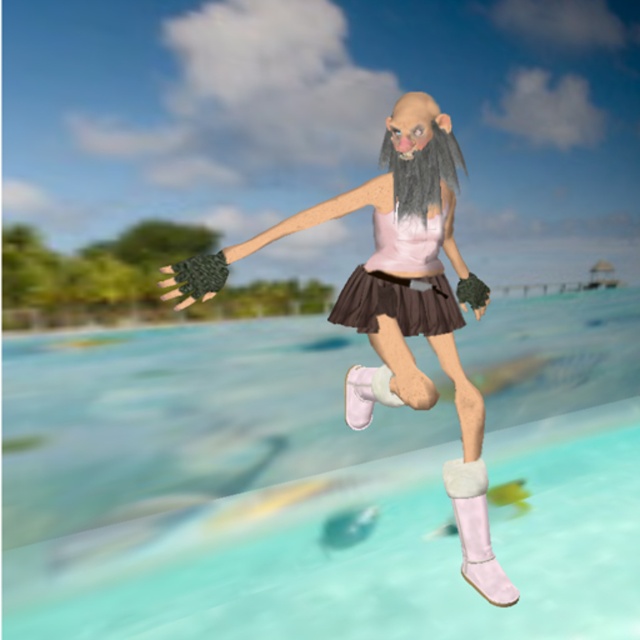
Does point (424, 316) come farther from viewer compared to point (451, 156)?

Yes, point (424, 316) is behind point (451, 156).

In the scene shown: Between pink matte dress at center and black matte hair at center, which one has less height?

With less height is black matte hair at center.

Which is behind, point (397, 220) or point (416, 170)?

The point (397, 220) is behind.

At what (x,y) coordinates should I click in order to perform the action: click on pink matte dress at center. Please return your answer as a coordinate pair (x, y). The image size is (640, 640). Looking at the image, I should click on (401, 280).

Who is lower down, matte pink tank top at center or black matte hair at center?

matte pink tank top at center is lower down.

Is matte pink tank top at center above black matte hair at center?

No.

Measure the distance between point (426,218) and camera.

Point (426,218) and camera are 1.85 meters apart.

Identify the location of matte pink tank top at center. The height and width of the screenshot is (640, 640). (401, 305).

Based on the photo, does matte pink tank top at center appear on the right side of pink matte dress at center?

No, matte pink tank top at center is not to the right of pink matte dress at center.

Does matte pink tank top at center lie in front of pink matte dress at center?

Yes, it is.

Is point (474, 550) farther from viewer compared to point (396, 284)?

No, it is not.

Locate an element on the screen. The height and width of the screenshot is (640, 640). matte pink tank top at center is located at coordinates pyautogui.click(x=401, y=305).